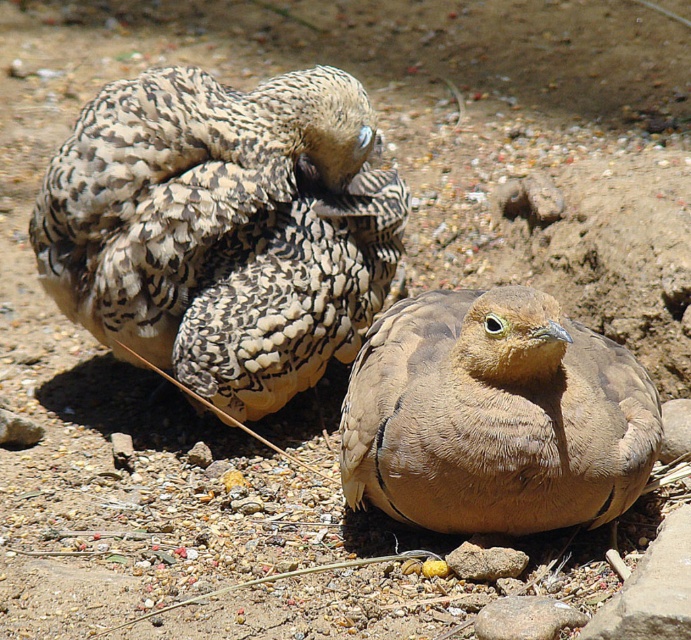
Question: Is speckled feathers at center to the right of brown feathered bird at center from the viewer's perspective?

Choices:
 (A) no
 (B) yes

Answer: (A)

Question: Which of the following is the closest to the observer?

Choices:
 (A) brown feathered bird at center
 (B) speckled feathers at center

Answer: (A)

Question: Which point is closer to the camera taking this photo?

Choices:
 (A) (565, 458)
 (B) (189, 236)

Answer: (A)

Question: Can you confirm if speckled feathers at center is positioned to the right of brown feathered bird at center?

Choices:
 (A) yes
 (B) no

Answer: (B)

Question: Which of the following is the closest to the observer?

Choices:
 (A) (263, 305)
 (B) (397, 316)

Answer: (B)

Question: Does speckled feathers at center have a larger size compared to brown feathered bird at center?

Choices:
 (A) yes
 (B) no

Answer: (A)